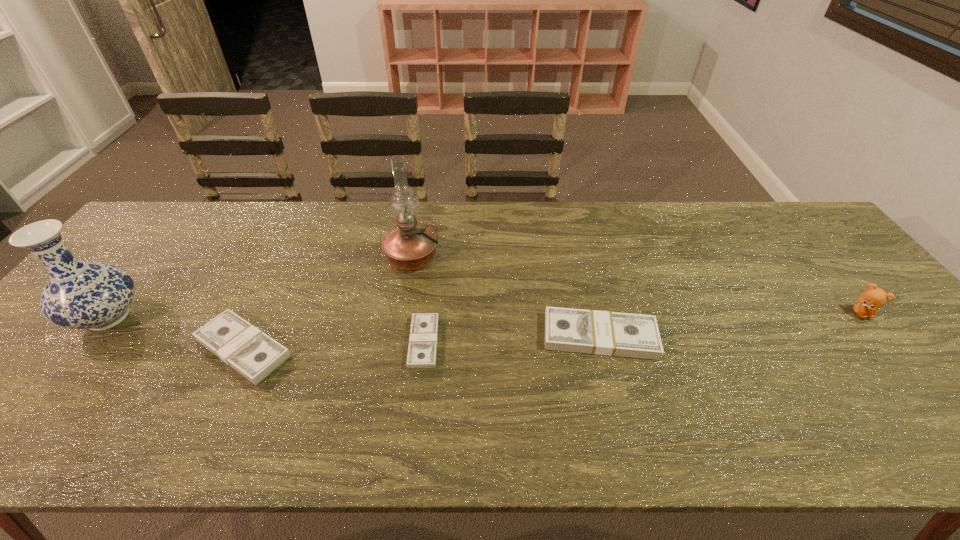
Locate which object ranks third in proximity to the shortest object. Please provide its 2D coordinates. Your answer should be formatted as a tuple, i.e. [(x, y)], where the tuple contains the x and y coordinates of a point satisfying the conditions above.

[(252, 353)]

Where is `object that is the second closest one to the rightmost object`? This screenshot has height=540, width=960. object that is the second closest one to the rightmost object is located at coordinates (422, 349).

I want to click on dollar that is the third closest one to the leftmost object, so click(608, 333).

Locate which dollar is the closest to the vase. Please provide its 2D coordinates. Your answer should be formatted as a tuple, i.e. [(x, y)], where the tuple contains the x and y coordinates of a point satisfying the conditions above.

[(252, 353)]

Locate an element on the screen. This screenshot has width=960, height=540. free space that satisfies the following two spatial constraints: 1. on the front side of the second tallest object; 2. on the left side of the second tallest dollar is located at coordinates (84, 348).

Find the location of a particular element. The width and height of the screenshot is (960, 540). vacant area that satisfies the following two spatial constraints: 1. on the front side of the second dollar from right to left; 2. on the left side of the fifth shortest object is located at coordinates (89, 342).

In order to click on vacant space that satisfies the following two spatial constraints: 1. on the back side of the second object from right to left; 2. on the right side of the second dollar from right to left in this screenshot , I will do `click(424, 336)`.